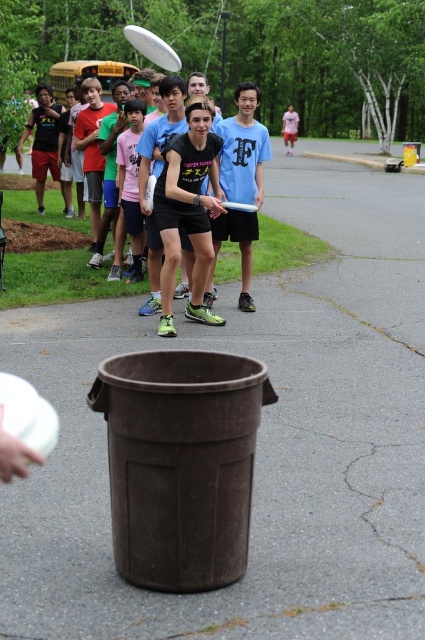
You are standing at the center of the image and see a point marked at coordinates (201, 195). What object is located exactly at that point?

The matte black t shirt at center is located exactly at point (201, 195).